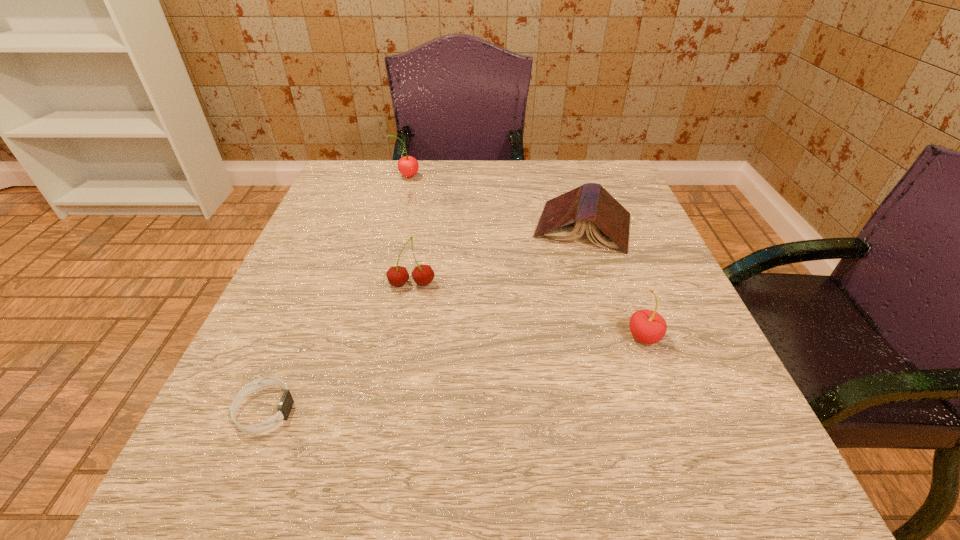
Image resolution: width=960 pixels, height=540 pixels. In order to click on free location that satisfies the following two spatial constraints: 1. on the surface of the third nearest object; 2. on the outer surface of the leftmost object in this screenshot , I will do `click(390, 410)`.

You are a GUI agent. You are given a task and a screenshot of the screen. Output one action in this format:
    pyautogui.click(x=<x>, y=<y>)
    Task: Click on the free space in the image that satisfies the following two spatial constraints: 1. on the surface of the third farthest object; 2. on the outer surface of the leftmost object
    The image size is (960, 540).
    Given the screenshot: What is the action you would take?
    pyautogui.click(x=390, y=410)